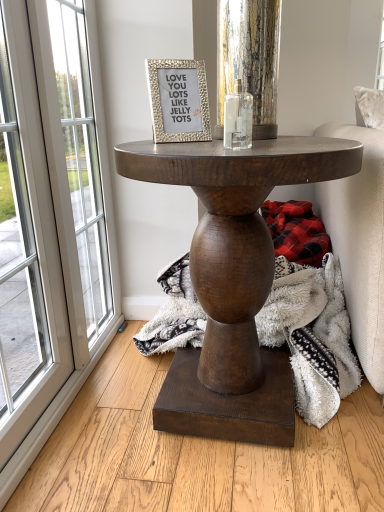
The image size is (384, 512). Describe the element at coordinates (296, 232) in the screenshot. I see `plaid fabric at lower right` at that location.

I want to click on dark wood table at center, so click(233, 280).

Does point (169, 66) appear closer or farther from the camera than point (251, 123)?

Clearly, point (169, 66) is more distant from the camera than point (251, 123).

Does gold textured frame at upper center have a greater height compared to clear glass candle holder at center?

Yes.

Which object is further away from the camera, gold textured frame at upper center or clear glass candle holder at center?

gold textured frame at upper center is further from the camera.

Does gold textured frame at upper center have a smaller size compared to clear glass candle holder at center?

Actually, gold textured frame at upper center might be larger than clear glass candle holder at center.

Which of these two, gold textured frame at upper center or dark wood table at center, is wider?

dark wood table at center is wider.

Would you say gold textured frame at upper center is a long distance from dark wood table at center?

gold textured frame at upper center is actually quite close to dark wood table at center.

What's the angular difference between gold textured frame at upper center and dark wood table at center's facing directions?

22.6 degrees.

Is plaid fabric at lower right not near clear glass candle holder at center?

No.

Which is more to the right, plaid fabric at lower right or clear glass candle holder at center?

plaid fabric at lower right.

From a real-world perspective, is plaid fabric at lower right positioned above or below clear glass candle holder at center?

In terms of real-world spatial position, plaid fabric at lower right is below clear glass candle holder at center.

From the image's perspective, is plaid fabric at lower right located above or below clear glass candle holder at center?

Based on their image positions, plaid fabric at lower right is located beneath clear glass candle holder at center.

From a real-world perspective, who is located higher, white glass screen door at left or gold textured frame at upper center?

gold textured frame at upper center, from a real-world perspective.

Who is more distant, white glass screen door at left or gold textured frame at upper center?

white glass screen door at left is more distant.

Can you confirm if white glass screen door at left is taller than gold textured frame at upper center?

Yes, white glass screen door at left is taller than gold textured frame at upper center.

Can you confirm if white glass screen door at left is thinner than gold textured frame at upper center?

No.

Between plaid fabric at lower right and white glass screen door at left, which one has larger size?

With larger size is white glass screen door at left.

In the image, there is a white glass screen door at left. At what (x,y) coordinates should I click in order to perform the action: click on blanket below it (from a real-world perspective). Please return your answer as a coordinate pair (x, y). The height and width of the screenshot is (512, 384). Looking at the image, I should click on (296, 232).

Which is in front, point (284, 219) or point (7, 278)?

The point (7, 278) is in front.

Is gold textured frame at upper center beside white glass screen door at left?

No, gold textured frame at upper center is not in contact with white glass screen door at left.

Which point is more forward, (184,114) or (74,223)?

Point (184,114)

Is gold textured frame at upper center closer to camera compared to white glass screen door at left?

Yes, it is in front of white glass screen door at left.

In terms of width, does gold textured frame at upper center look wider or thinner when compared to white glass screen door at left?

Clearly, gold textured frame at upper center has less width compared to white glass screen door at left.

Is clear glass candle holder at center positioned with its back to plaid fabric at lower right?

clear glass candle holder at center does not have its back to plaid fabric at lower right.

Is clear glass candle holder at center not close to plaid fabric at lower right?

No, there isn't a large distance between clear glass candle holder at center and plaid fabric at lower right.

From a real-world perspective, between clear glass candle holder at center and plaid fabric at lower right, who is vertically lower?

In real-world perspective, plaid fabric at lower right is lower.

Is clear glass candle holder at center smaller than plaid fabric at lower right?

Yes.

The width and height of the screenshot is (384, 512). Identify the location of picture frame behind the clear glass candle holder at center. (178, 100).

I want to click on picture frame above the dark wood table at center (from the image's perspective), so click(x=178, y=100).

Estimate the real-world distances between objects in this image. Which object is further from white glass screen door at left, plaid fabric at lower right or gold textured frame at upper center?

plaid fabric at lower right is further to white glass screen door at left.

Looking at the image, which one is located closer to white glass screen door at left, dark wood table at center or gold textured frame at upper center?

dark wood table at center lies closer to white glass screen door at left than the other object.

From the image, which object appears to be farther from dark wood table at center, white glass screen door at left or clear glass candle holder at center?

white glass screen door at left.

From the picture: Looking at the image, which one is located further to plaid fabric at lower right, white glass screen door at left or gold textured frame at upper center?

white glass screen door at left.

Estimate the real-world distances between objects in this image. Which object is closer to gold textured frame at upper center, plaid fabric at lower right or dark wood table at center?

dark wood table at center.

Which object lies further to the anchor point dark wood table at center, gold textured frame at upper center or white glass screen door at left?

white glass screen door at left is positioned further to the anchor dark wood table at center.

When comparing their distances from clear glass candle holder at center, does gold textured frame at upper center or white glass screen door at left seem closer?

gold textured frame at upper center lies closer to clear glass candle holder at center than the other object.

From the picture: From the image, which object appears to be farther from gold textured frame at upper center, plaid fabric at lower right or clear glass candle holder at center?

Among the two, plaid fabric at lower right is located further to gold textured frame at upper center.

Find the location of a particular element. Image resolution: width=384 pixels, height=512 pixels. picture frame between white glass screen door at left and dark wood table at center is located at coordinates (178, 100).

Image resolution: width=384 pixels, height=512 pixels. Identify the location of picture frame located between white glass screen door at left and plaid fabric at lower right in the left-right direction. point(178,100).

Find the location of `picture frame between dark wood table at center and plaid fabric at lower right in the front-back direction`. picture frame between dark wood table at center and plaid fabric at lower right in the front-back direction is located at coordinates (178, 100).

Identify the location of picture frame between white glass screen door at left and clear glass candle holder at center in the horizontal direction. (178, 100).